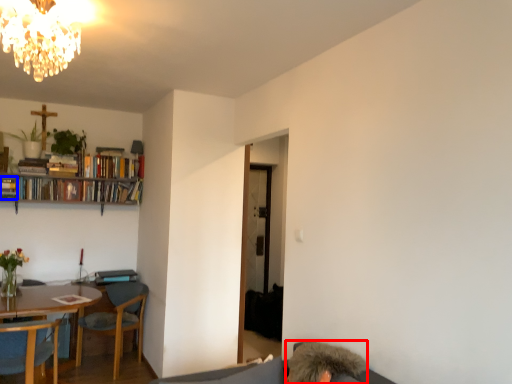
Question: Which object is further to the camera taking this photo, person (highlighted by a red box) or book (highlighted by a blue box)?

Choices:
 (A) person
 (B) book

Answer: (B)